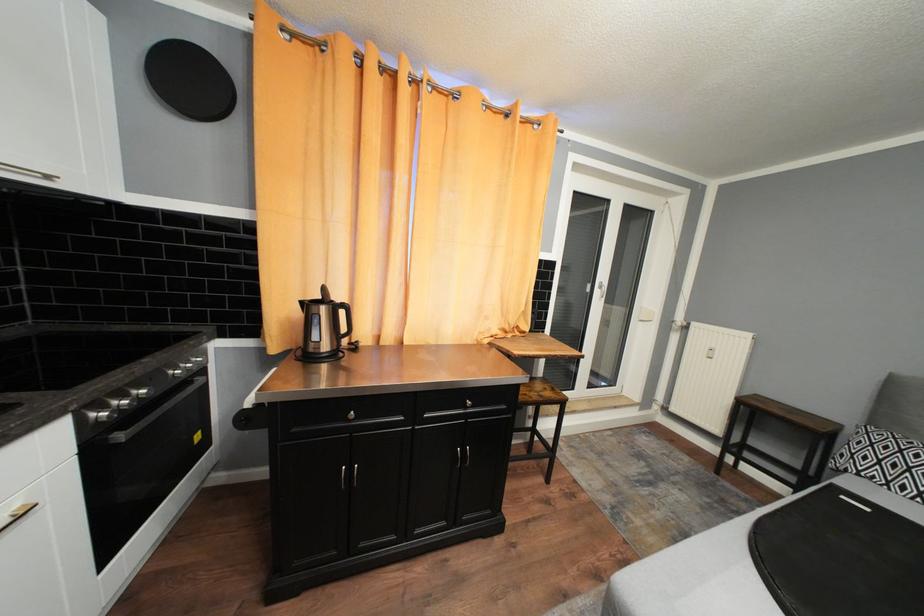
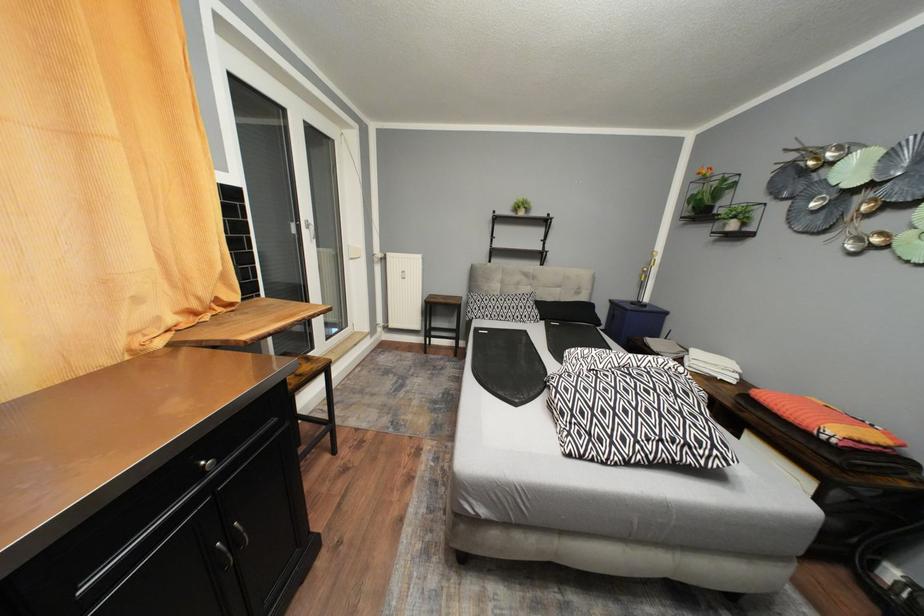
How did the camera likely rotate?

The camera rotated toward right-down.